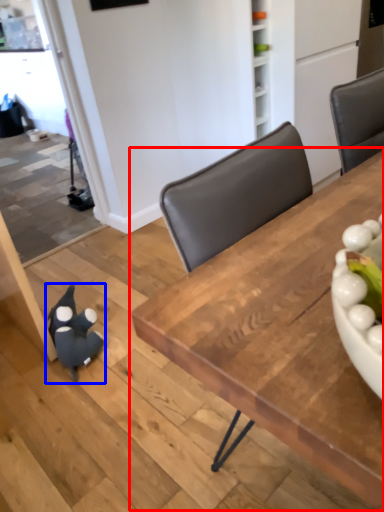
Question: Which of the following is the farthest to the observer, table (highlighted by a red box) or toy (highlighted by a blue box)?

Choices:
 (A) table
 (B) toy

Answer: (B)